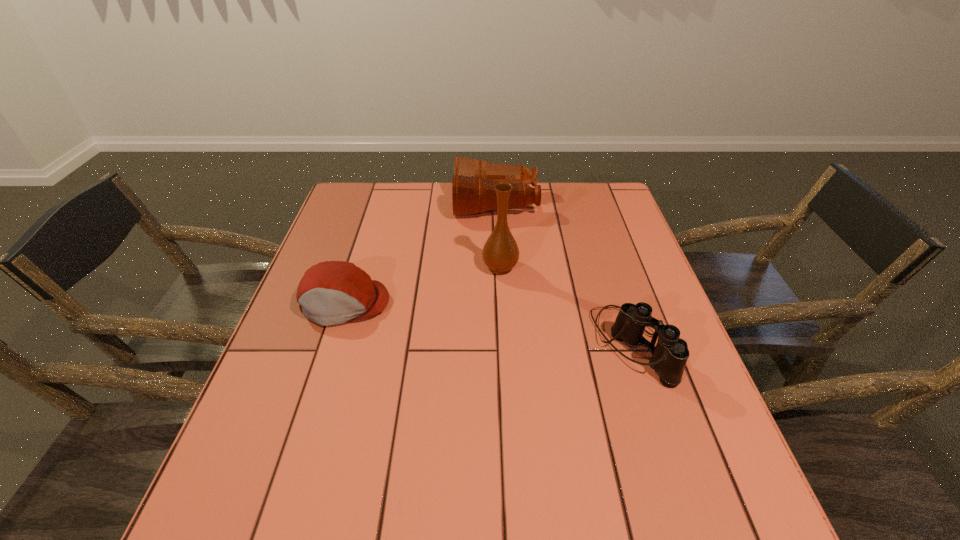
This screenshot has width=960, height=540. In order to click on unoccupied area between the left binoculars and the rightmost object in this screenshot , I will do [x=564, y=274].

Identify the location of unoccupied position between the cap and the tallest object. point(422,285).

At what (x,y) coordinates should I click in order to perform the action: click on vacant area that lies between the farther binoculars and the cap. Please return your answer as a coordinate pair (x, y). Looking at the image, I should click on (420, 253).

In order to click on free point between the left binoculars and the nearer binoculars in this screenshot , I will do `click(564, 274)`.

You are a GUI agent. You are given a task and a screenshot of the screen. Output one action in this format:
    pyautogui.click(x=<x>, y=<y>)
    Task: Click on the object that is the third closest to the farthest object
    This screenshot has height=540, width=960.
    Given the screenshot: What is the action you would take?
    pyautogui.click(x=669, y=356)

Choose which object is the second nearest neighbor to the vase. Please provide its 2D coordinates. Your answer should be formatted as a tuple, i.e. [(x, y)], where the tuple contains the x and y coordinates of a point satisfying the conditions above.

[(669, 356)]

This screenshot has height=540, width=960. I want to click on vacant space that satisfies the following two spatial constraints: 1. through the lenses of the vase; 2. on the left side of the left binoculars, so click(x=499, y=267).

The height and width of the screenshot is (540, 960). I want to click on vacant position in the image that satisfies the following two spatial constraints: 1. through the lenses of the left binoculars; 2. on the front-facing side of the shortest object, so click(x=500, y=303).

Where is `vacant region that satisfies the following two spatial constraints: 1. through the lenses of the farther binoculars; 2. on the left side of the nearer binoculars`? This screenshot has width=960, height=540. vacant region that satisfies the following two spatial constraints: 1. through the lenses of the farther binoculars; 2. on the left side of the nearer binoculars is located at coordinates (503, 346).

The width and height of the screenshot is (960, 540). In order to click on vacant position in the image that satisfies the following two spatial constraints: 1. on the back side of the second farthest object; 2. through the lenses of the farther binoculars in this screenshot , I will do `click(497, 203)`.